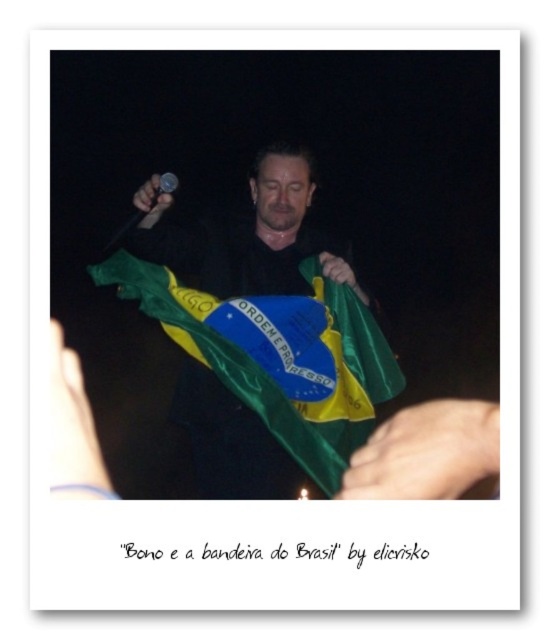
Is point (341, 332) positioned behind point (169, 180)?

Yes, point (341, 332) is behind point (169, 180).

From the picture: Does greenmatte fabricflag at center have a larger size compared to shiny metallic microphone at upper center?

Yes, greenmatte fabricflag at center is bigger than shiny metallic microphone at upper center.

Locate an element on the screen. The width and height of the screenshot is (550, 640). greenmatte fabricflag at center is located at coordinates (278, 356).

Where is `greenmatte fabricflag at center`? The height and width of the screenshot is (640, 550). greenmatte fabricflag at center is located at coordinates (278, 356).

How far apart are white matte skin at lower left and shiny metallic microphone at upper center?

6.42 feet

Can you confirm if white matte skin at lower left is positioned above shiny metallic microphone at upper center?

No.

You are a GUI agent. You are given a task and a screenshot of the screen. Output one action in this format:
    pyautogui.click(x=<x>, y=<y>)
    Task: Click on the white matte skin at lower left
    
    Given the screenshot: What is the action you would take?
    pyautogui.click(x=73, y=428)

Is point (229, 365) more distant than point (112, 484)?

Yes.

In the scene shown: Between greenmatte fabricflag at center and white matte skin at lower left, which one appears on the right side from the viewer's perspective?

greenmatte fabricflag at center is more to the right.

Between point (145, 278) and point (58, 342), which one is positioned behind?

The point (145, 278) is behind.

Image resolution: width=550 pixels, height=640 pixels. I want to click on greenmatte fabricflag at center, so click(278, 356).